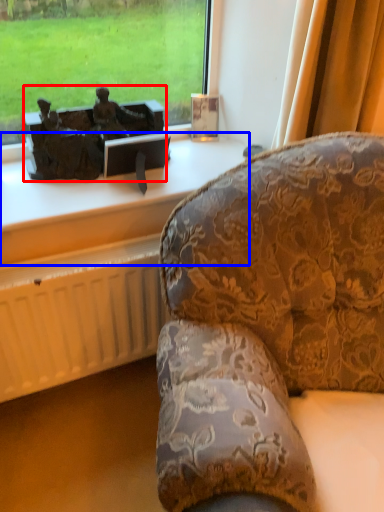
Question: Among these objects, which one is farthest to the camera, antique (highlighted by a red box) or furniture (highlighted by a blue box)?

Choices:
 (A) antique
 (B) furniture

Answer: (A)